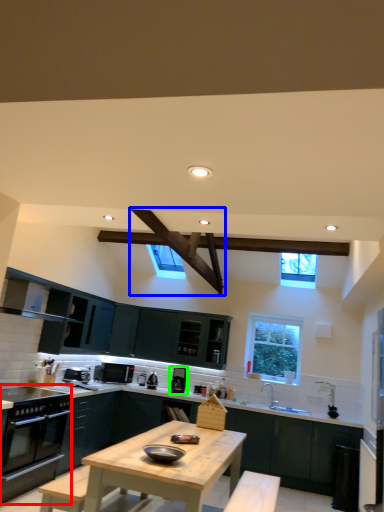
Question: Which is farther away from kitchen appliance (highlighted by a red box)? exhaust hood (highlighted by a blue box) or appliance (highlighted by a green box)?

Choices:
 (A) exhaust hood
 (B) appliance

Answer: (B)